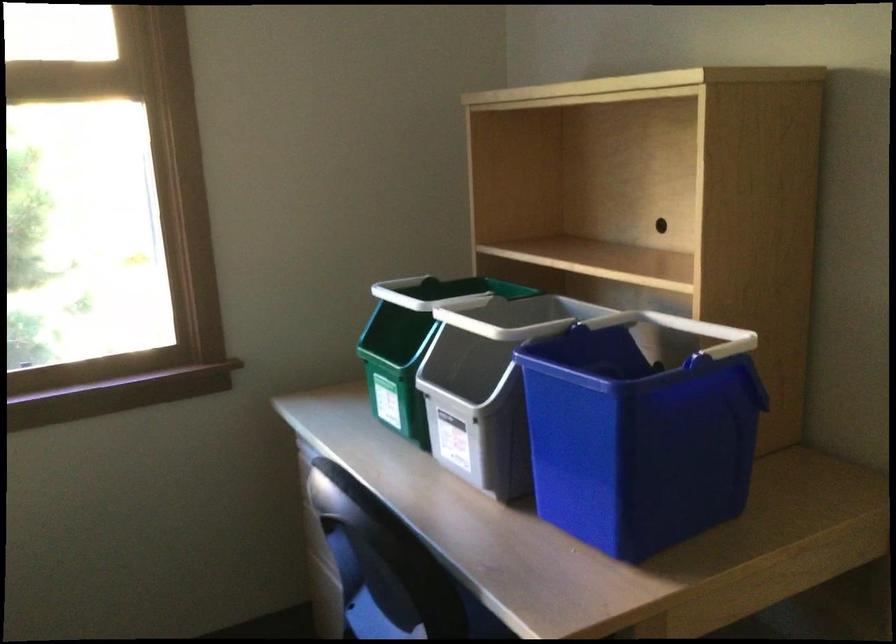
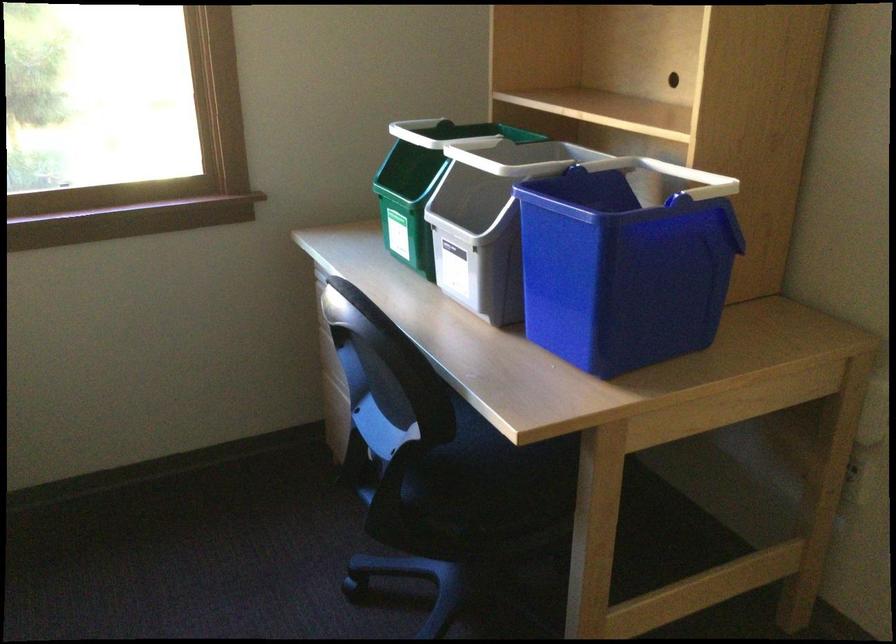
Where in the second image is the point corresponding to point 411,343 from the first image?

(421, 184)